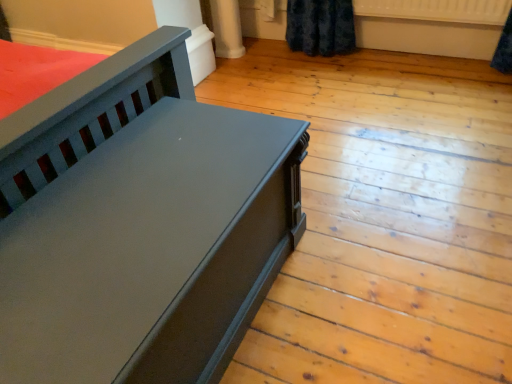
Question: Considering the positions of point (355, 6) and point (153, 294), is point (355, 6) closer or farther from the camera than point (153, 294)?

Choices:
 (A) closer
 (B) farther

Answer: (B)

Question: From a real-world perspective, is white plastic radiator at upper right positioned above or below matte black bench at left?

Choices:
 (A) above
 (B) below

Answer: (A)

Question: From the image's perspective, is white plastic radiator at upper right located above or below matte black bench at left?

Choices:
 (A) below
 (B) above

Answer: (B)

Question: Is matte black bench at left situated inside white plastic radiator at upper right or outside?

Choices:
 (A) outside
 (B) inside

Answer: (A)

Question: From the image's perspective, relative to white plastic radiator at upper right, is matte black bench at left above or below?

Choices:
 (A) below
 (B) above

Answer: (A)

Question: Looking at the image, does matte black bench at left seem bigger or smaller compared to white plastic radiator at upper right?

Choices:
 (A) big
 (B) small

Answer: (A)

Question: From a real-world perspective, relative to white plastic radiator at upper right, is matte black bench at left vertically above or below?

Choices:
 (A) below
 (B) above

Answer: (A)